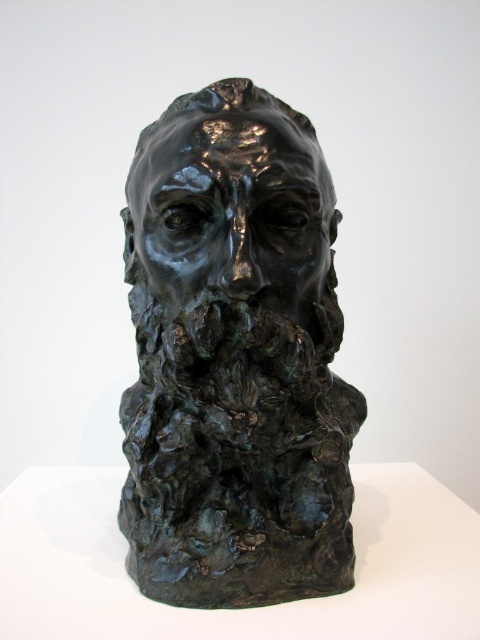
Question: Which of the following is the closest to the observer?

Choices:
 (A) (233, 160)
 (B) (266, 488)

Answer: (A)

Question: Is bronze textured head at center bigger than shiny bronze face at center?

Choices:
 (A) no
 (B) yes

Answer: (B)

Question: Which object appears closest to the camera in this image?

Choices:
 (A) bronze textured head at center
 (B) shiny bronze face at center

Answer: (A)

Question: Is bronze textured head at center behind shiny bronze face at center?

Choices:
 (A) yes
 (B) no

Answer: (B)

Question: Does bronze textured head at center appear on the right side of shiny bronze face at center?

Choices:
 (A) no
 (B) yes

Answer: (B)

Question: Among these points, which one is farthest from the camera?

Choices:
 (A) (299, 272)
 (B) (311, 230)

Answer: (B)